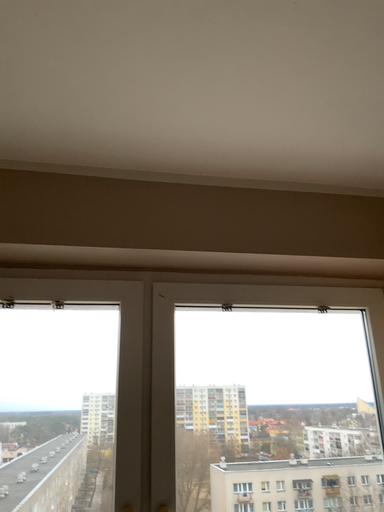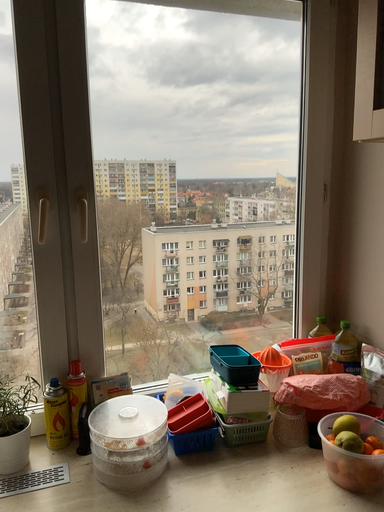
Question: Which way did the camera rotate in the video?

Choices:
 (A) rotated right
 (B) rotated left

Answer: (A)